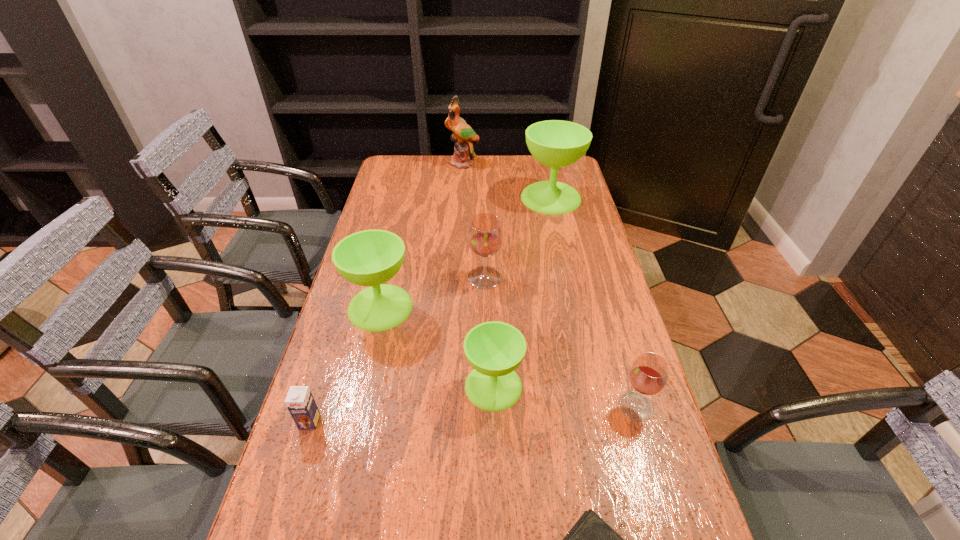
Locate an element on the screen. Image resolution: width=960 pixels, height=540 pixels. the right red wineglass is located at coordinates (648, 375).

Locate an element on the screen. the smaller red wineglass is located at coordinates (648, 375).

This screenshot has height=540, width=960. Find the location of `the seventh tallest object`. the seventh tallest object is located at coordinates (300, 402).

Locate an element on the screen. The image size is (960, 540). vacant space situated on the front-facing side of the green parrot is located at coordinates (462, 190).

Identify the location of free spot located on the left of the tallest wineglass. The image size is (960, 540). (479, 198).

The height and width of the screenshot is (540, 960). In order to click on vacant region located 0.200m on the right of the bigger red wineglass in this screenshot , I will do `click(568, 278)`.

This screenshot has height=540, width=960. Find the location of `vacant space located on the back of the second farthest green wineglass`. vacant space located on the back of the second farthest green wineglass is located at coordinates (391, 262).

Where is `vacant space situated on the front of the smallest green wineglass`? This screenshot has height=540, width=960. vacant space situated on the front of the smallest green wineglass is located at coordinates (494, 432).

Find the location of `blank area located on the left of the nearer red wineglass`. blank area located on the left of the nearer red wineglass is located at coordinates (557, 406).

Locate an element on the screen. vacant space located 0.180m on the front label of the second shortest object is located at coordinates (279, 518).